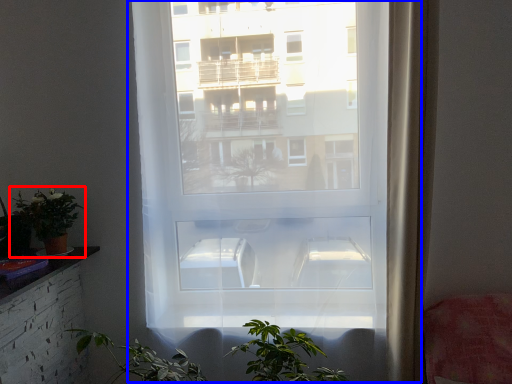
Question: Which object is further to the camera taking this photo, houseplant (highlighted by a red box) or window (highlighted by a blue box)?

Choices:
 (A) houseplant
 (B) window

Answer: (A)